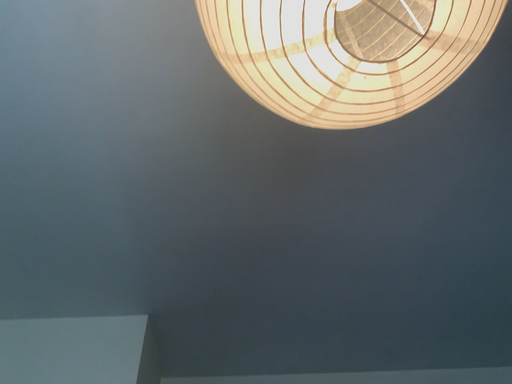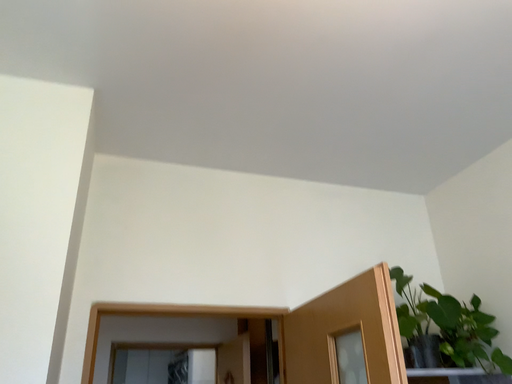
Question: Which way did the camera rotate in the video?

Choices:
 (A) rotated downward
 (B) rotated upward

Answer: (A)